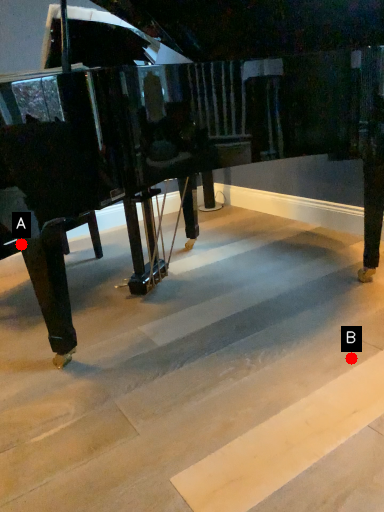
Question: Two points are circled on the image, labeled by A and B beside each circle. Which point is closer to the camera?

Choices:
 (A) A is closer
 (B) B is closer

Answer: (A)